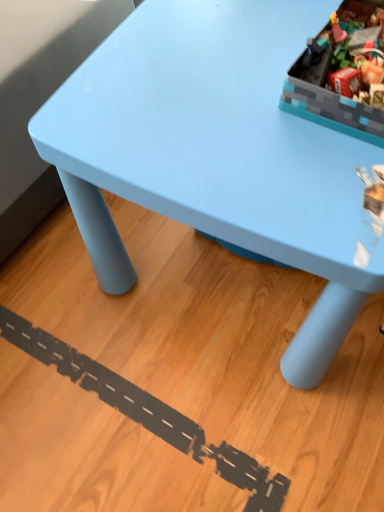
This screenshot has width=384, height=512. In order to click on free space on the front side of matte plastic storage box at upper right in this screenshot , I will do `click(322, 195)`.